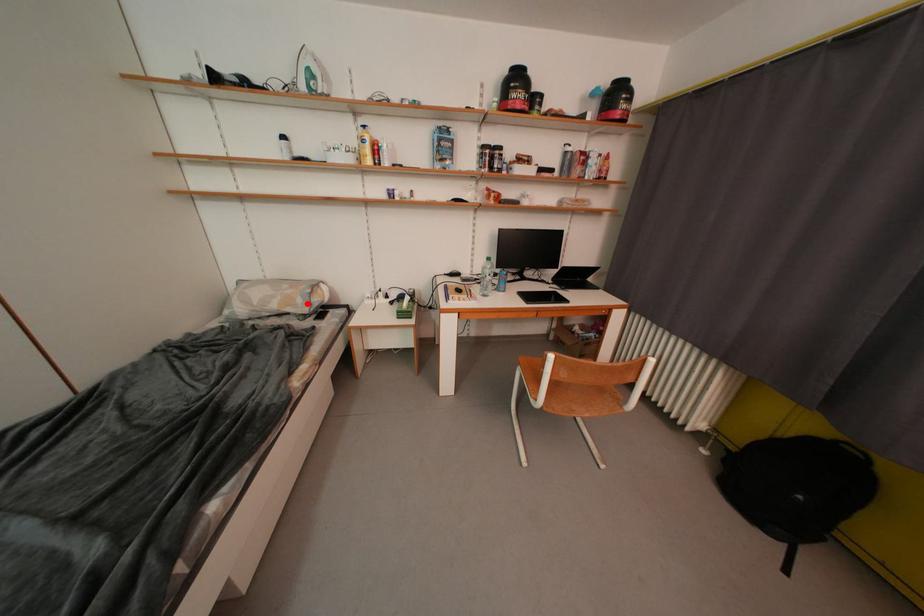
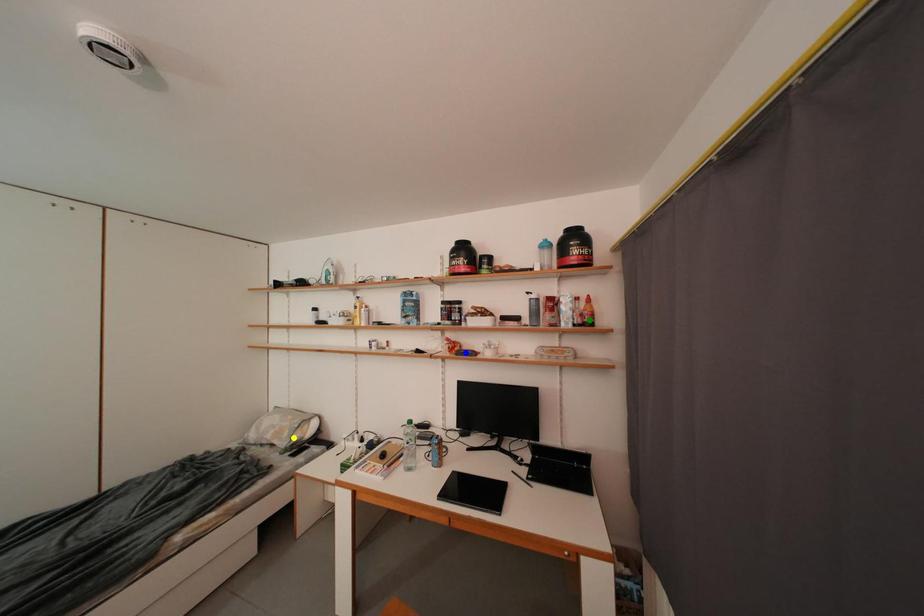
Question: I am providing you with two images of the same scene from different viewpoints. A red point is marked on the first image. You are given multiple points on the second image. Which point in image 2 represents the same 3d spot as the red point in image 1?

Choices:
 (A) green point
 (B) yellow point
 (C) blue point

Answer: (B)